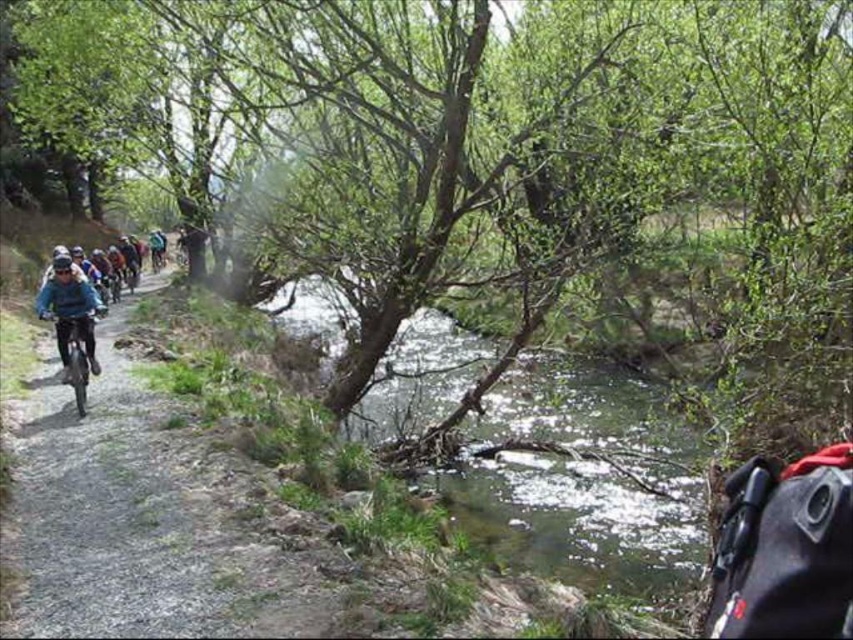
From the picture: Can you confirm if green leafy creek at center is shorter than shiny blue frame at left?

No, green leafy creek at center is not shorter than shiny blue frame at left.

Does green leafy creek at center have a larger size compared to shiny blue frame at left?

Indeed, green leafy creek at center has a larger size compared to shiny blue frame at left.

Locate an element on the screen. green leafy creek at center is located at coordinates (587, 522).

What do you see at coordinates (151, 522) in the screenshot? I see `gravel path at left` at bounding box center [151, 522].

Does gravel path at left have a greater height compared to green leafy creek at center?

Incorrect, gravel path at left's height is not larger of green leafy creek at center's.

Is point (308, 588) positioned after point (683, 451)?

No, it is in front of (683, 451).

The image size is (853, 640). Identify the location of gravel path at left. (151, 522).

Between green leafy tree at upper center and green leafy creek at center, which one is positioned lower?

green leafy creek at center is below.

Is green leafy tree at upper center in front of green leafy creek at center?

Yes, it is in front of green leafy creek at center.

What do you see at coordinates (491, 150) in the screenshot?
I see `green leafy tree at upper center` at bounding box center [491, 150].

What are the coordinates of `green leafy tree at upper center` in the screenshot? It's located at (491, 150).